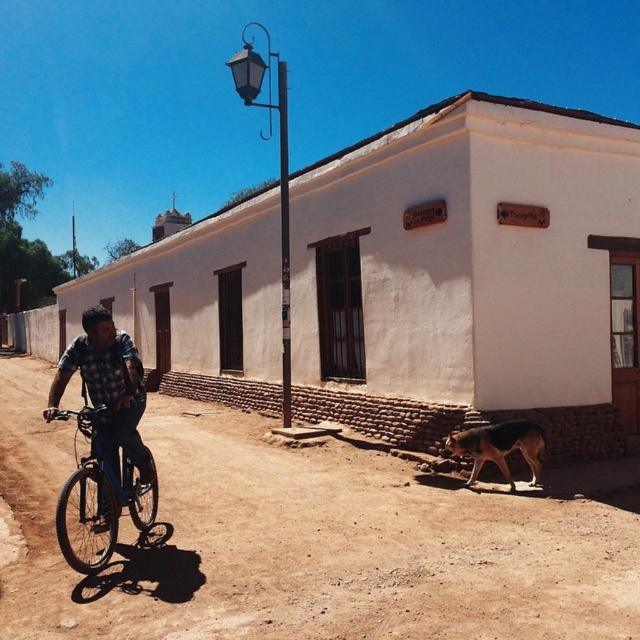
Is matte black bicycle at left shorter than brown fur dog at lower right?

In fact, matte black bicycle at left may be taller than brown fur dog at lower right.

Is point (86, 572) in front of point (484, 449)?

Yes, point (86, 572) is in front of point (484, 449).

Find the location of a particular element. matte black bicycle at left is located at coordinates (100, 492).

What are the coordinates of `matte black bicycle at left` in the screenshot? It's located at (100, 492).

Based on the photo, between checkered fabric shirt at left and brown fur dog at lower right, which one has more height?

With more height is checkered fabric shirt at left.

Between checkered fabric shirt at left and brown fur dog at lower right, which one appears on the left side from the viewer's perspective?

checkered fabric shirt at left is more to the left.

Does point (116, 458) lie in front of point (496, 426)?

That is True.

Where is `checkered fabric shirt at left`? checkered fabric shirt at left is located at coordinates [108, 390].

Does brown dirt track at lower center appear under checkered fabric shirt at left?

Yes, brown dirt track at lower center is below checkered fabric shirt at left.

What do you see at coordinates (307, 541) in the screenshot? This screenshot has height=640, width=640. I see `brown dirt track at lower center` at bounding box center [307, 541].

Where is `brown dirt track at lower center`? The image size is (640, 640). brown dirt track at lower center is located at coordinates (307, 541).